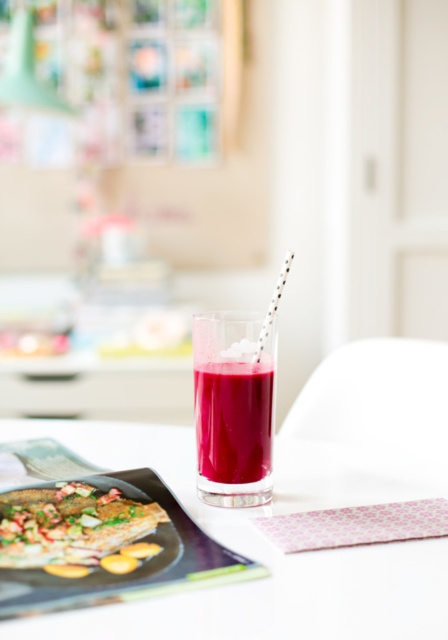
Question: Does shiny silver fish at center appear under translucent glass at center?

Choices:
 (A) yes
 (B) no

Answer: (A)

Question: Is translucent glass at center closer to the viewer compared to silver metallic straw at center?

Choices:
 (A) yes
 (B) no

Answer: (B)

Question: Among these objects, which one is farthest from the camera?

Choices:
 (A) silver metallic straw at center
 (B) translucent glass at center
 (C) matte glass platter at center
 (D) shiny silver fish at center

Answer: (B)

Question: Does shiny silver fish at center have a larger size compared to silver metallic straw at center?

Choices:
 (A) no
 (B) yes

Answer: (B)

Question: Which object is closer to the camera taking this photo?

Choices:
 (A) transparent glass at center
 (B) matte glass platter at center

Answer: (A)

Question: Which object is the closest to the shiny silver fish at center?

Choices:
 (A) matte glass platter at center
 (B) translucent glass at center

Answer: (A)